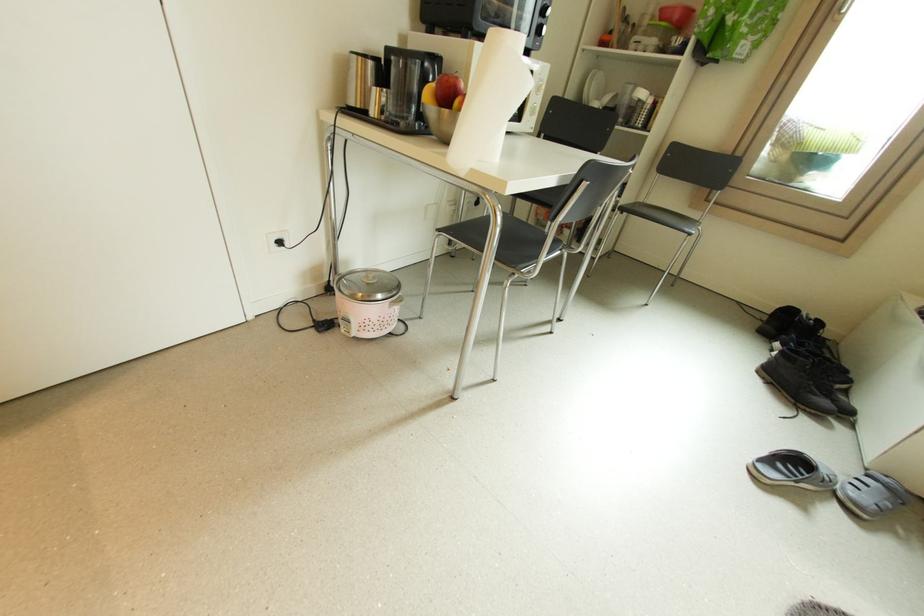
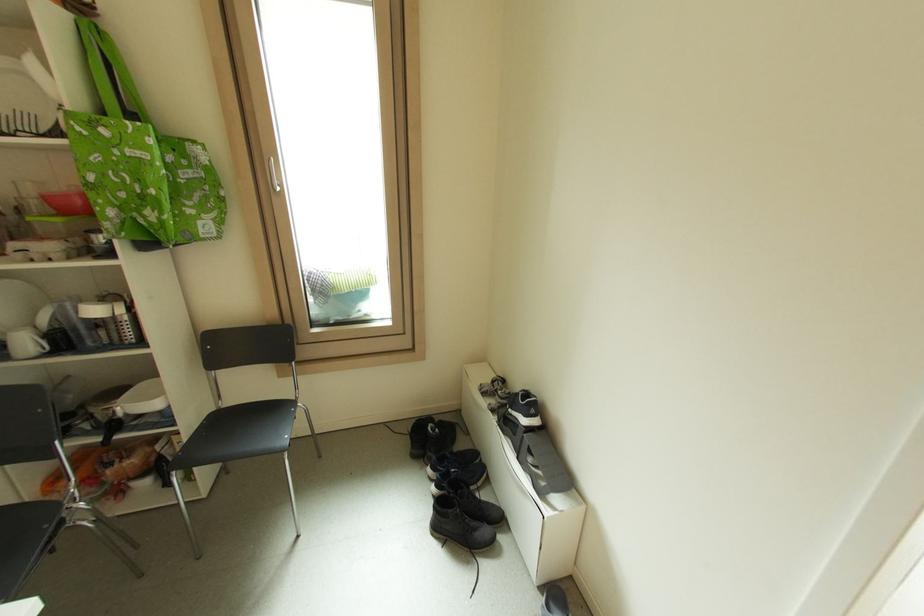
In the second image, find the point that corresponds to pixel 759 331 in the first image.

(415, 456)